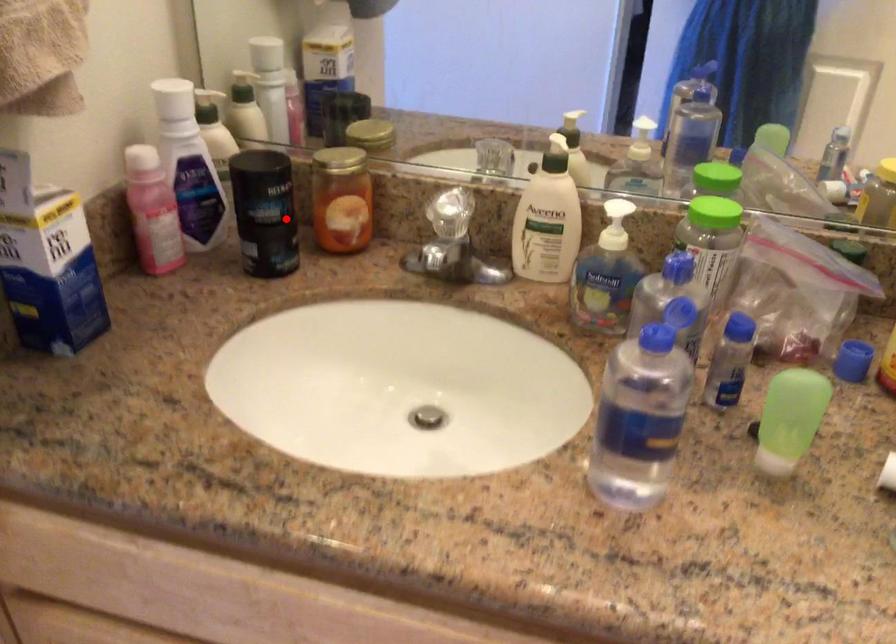
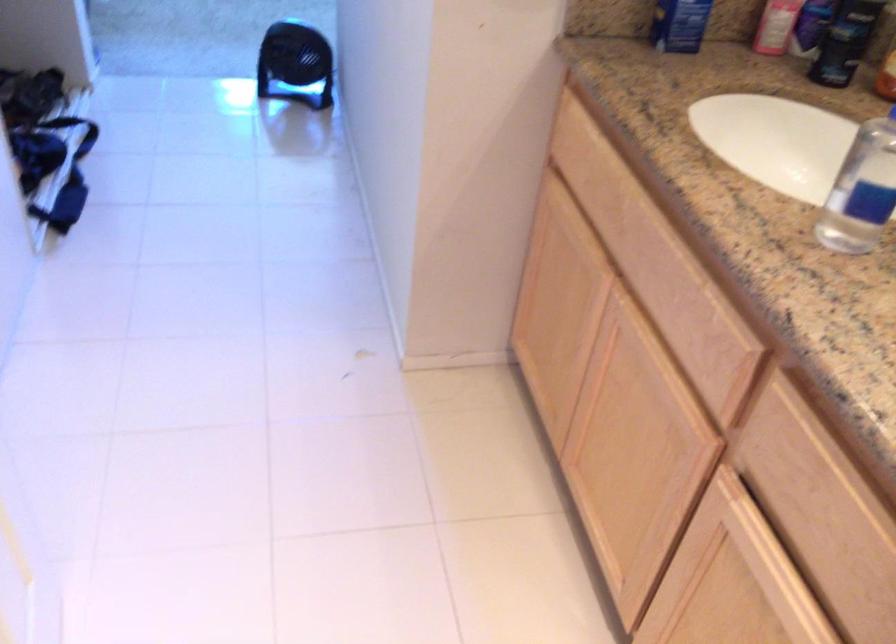
Question: I am providing you with two images of the same scene from different viewpoints. A red point is marked on the first image. Is the red point's position out of view in image 2?

Choices:
 (A) Yes
 (B) No

Answer: (B)